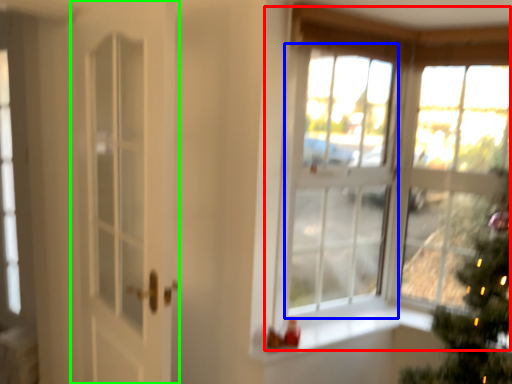
Question: Estimate the real-world distances between objects in this image. Which object is farther from window (highlighted by a red box), window (highlighted by a blue box) or door (highlighted by a green box)?

Choices:
 (A) window
 (B) door

Answer: (B)